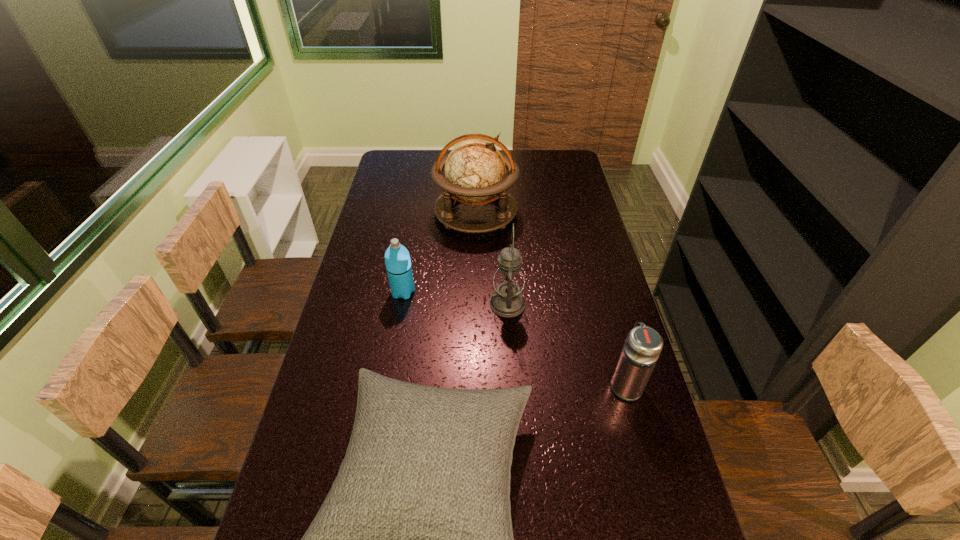
Identify the location of object that is the closest to the oil lamp. (414, 539).

Where is `object that is the fourth nearest to the left thermos bottle`? Image resolution: width=960 pixels, height=540 pixels. object that is the fourth nearest to the left thermos bottle is located at coordinates (643, 345).

Where is `vacant position in the image that satisfies the following two spatial constraints: 1. on the back side of the globe; 2. on the right side of the left thermos bottle`? The image size is (960, 540). vacant position in the image that satisfies the following two spatial constraints: 1. on the back side of the globe; 2. on the right side of the left thermos bottle is located at coordinates (417, 212).